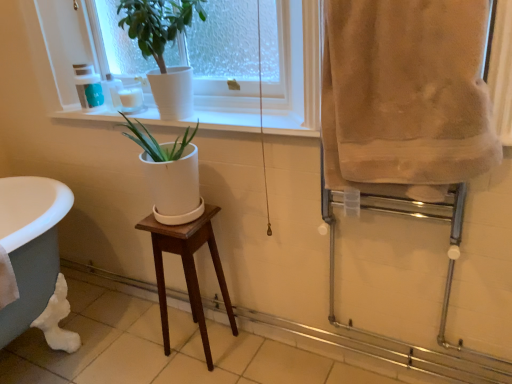
The height and width of the screenshot is (384, 512). What are the coordinates of `vacant space situated on the left part of mahogany wood stool at center` in the screenshot? It's located at (148, 352).